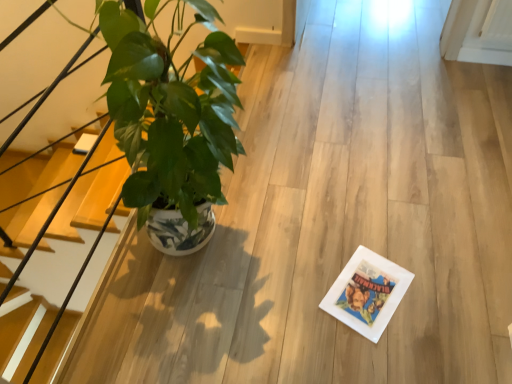
Where is `vacant space in front of green glossy plant at left`? This screenshot has height=384, width=512. vacant space in front of green glossy plant at left is located at coordinates (195, 334).